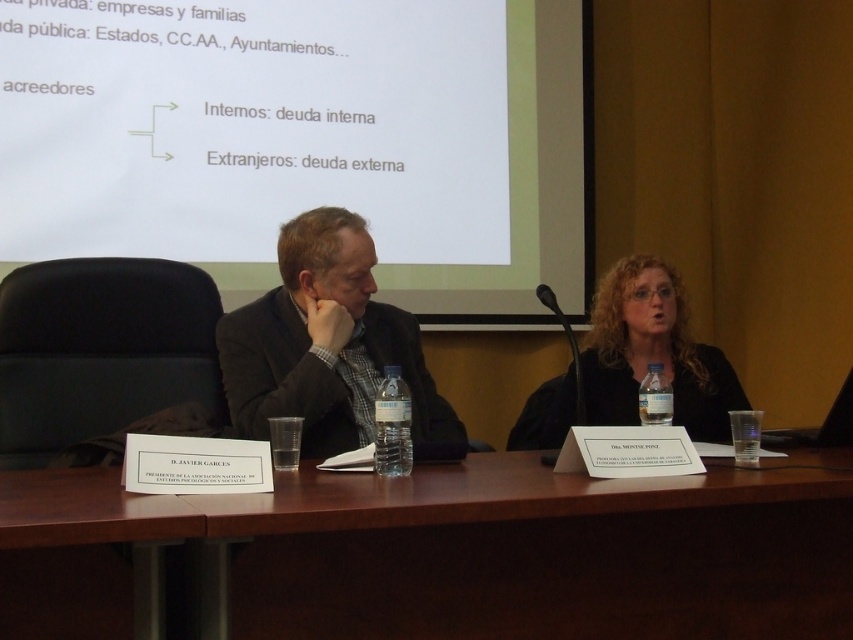
Question: Does white matte projector screen at upper center have a larger size compared to matte black suit at center?

Choices:
 (A) yes
 (B) no

Answer: (A)

Question: Which point is farther to the camera?

Choices:
 (A) matte black jacket at center
 (B) brown wood table at center
 (C) white matte projector screen at upper center

Answer: (C)

Question: Is white matte projector screen at upper center above brown wood table at center?

Choices:
 (A) no
 (B) yes

Answer: (B)

Question: Which object is closer to the camera taking this photo?

Choices:
 (A) brown wood table at center
 (B) white matte projector screen at upper center
 (C) matte black jacket at center
 (D) matte black suit at center

Answer: (A)

Question: Which point is closer to the camera?

Choices:
 (A) matte black jacket at center
 (B) matte black suit at center

Answer: (B)

Question: Can you confirm if brown wood table at center is positioned below matte black jacket at center?

Choices:
 (A) no
 (B) yes

Answer: (B)